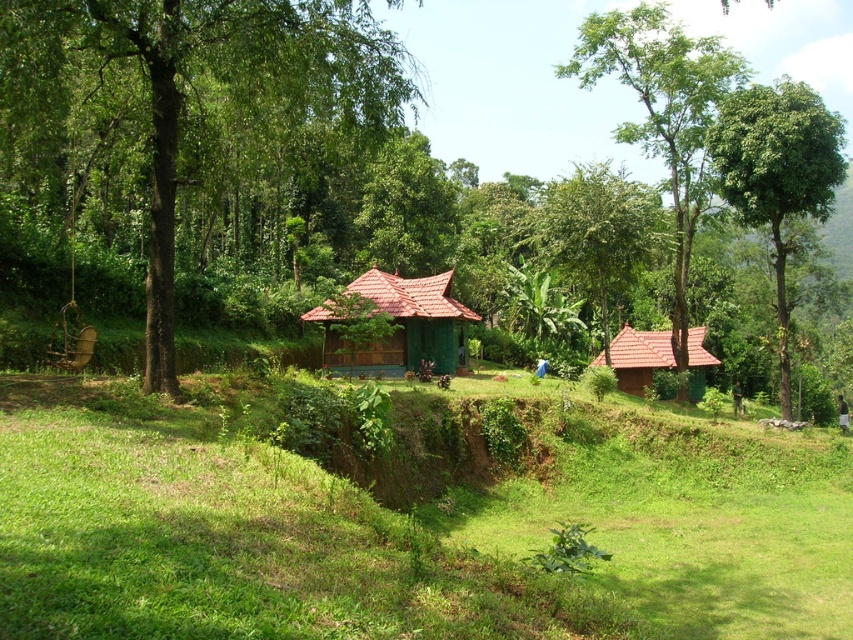
Does point (619, 236) lie in front of point (454, 355)?

No, (619, 236) is further to viewer.

Does green leafy tree at center have a smaller size compared to matte green wooden hut at center?

Actually, green leafy tree at center might be larger than matte green wooden hut at center.

This screenshot has width=853, height=640. Identify the location of green leafy tree at center. 599,230.

Find the location of a particular element. Image resolution: width=853 pixels, height=640 pixels. green leafy tree at center is located at coordinates (599, 230).

Can you confirm if green leafy tree at upper center is positioned to the right of matte green wooden hut at center?

Yes, green leafy tree at upper center is to the right of matte green wooden hut at center.

Can you confirm if green leafy tree at upper center is thinner than matte green wooden hut at center?

No.

Find the location of a particular element. The width and height of the screenshot is (853, 640). green leafy tree at upper center is located at coordinates (x=663, y=113).

At what (x,y) coordinates should I click in order to perform the action: click on green leafy tree at upper center. Please return your answer as a coordinate pair (x, y). The height and width of the screenshot is (640, 853). Looking at the image, I should click on (663, 113).

Is green leafy forest at center closer to camera compared to green leafy tree at center?

Yes.

Does green leafy forest at center appear under green leafy tree at center?

No, green leafy forest at center is not below green leafy tree at center.

Between point (350, 60) and point (622, 243), which one is positioned behind?

Point (622, 243)

You are a GUI agent. You are given a task and a screenshot of the screen. Output one action in this format:
    pyautogui.click(x=<x>, y=<y>)
    Task: Click on the green leafy forest at center
    The image size is (853, 640).
    Given the screenshot: What is the action you would take?
    pyautogui.click(x=218, y=140)